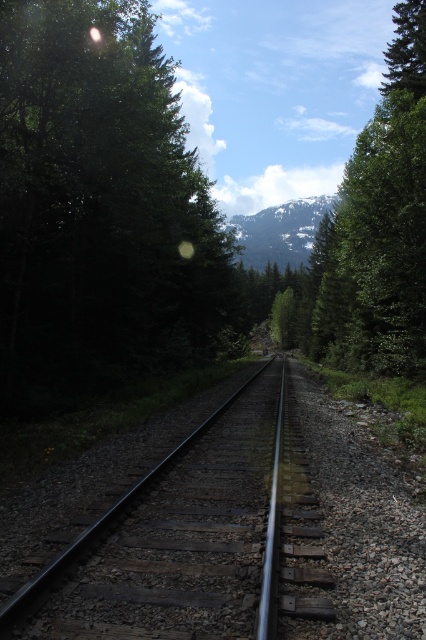
Can you confirm if smooth steel tracks at center is positioned above snowy rocky mountain at center?

No.

Between smooth steel tracks at center and snowy rocky mountain at center, which one appears on the right side from the viewer's perspective?

From the viewer's perspective, snowy rocky mountain at center appears more on the right side.

Is point (271, 524) positioned after point (310, 227)?

No, (271, 524) is closer to viewer.

What are the coordinates of `smooth steel tracks at center` in the screenshot? It's located at (180, 536).

What do you see at coordinates (180, 536) in the screenshot? This screenshot has width=426, height=640. I see `smooth steel tracks at center` at bounding box center [180, 536].

Between smooth steel tracks at center and green textured tree at upper right, which one is positioned higher?

green textured tree at upper right

Which is behind, point (278, 552) or point (394, 8)?

The point (394, 8) is behind.

This screenshot has height=640, width=426. Identify the location of smooth steel tracks at center. (180, 536).

Is green matte tree at left below snowy rocky mountain at center?

Yes.

Between green matte tree at left and snowy rocky mountain at center, which one is positioned higher?

snowy rocky mountain at center

The height and width of the screenshot is (640, 426). What are the coordinates of `green matte tree at left` in the screenshot? It's located at (98, 209).

Identify the location of green matte tree at left. This screenshot has width=426, height=640. (98, 209).